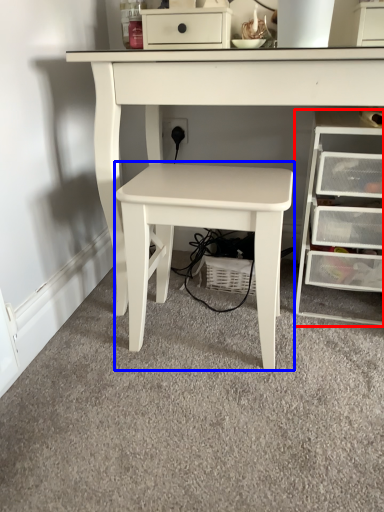
Question: Which point is further to the camera, chest of drawers (highlighted by a red box) or table (highlighted by a blue box)?

Choices:
 (A) chest of drawers
 (B) table

Answer: (A)